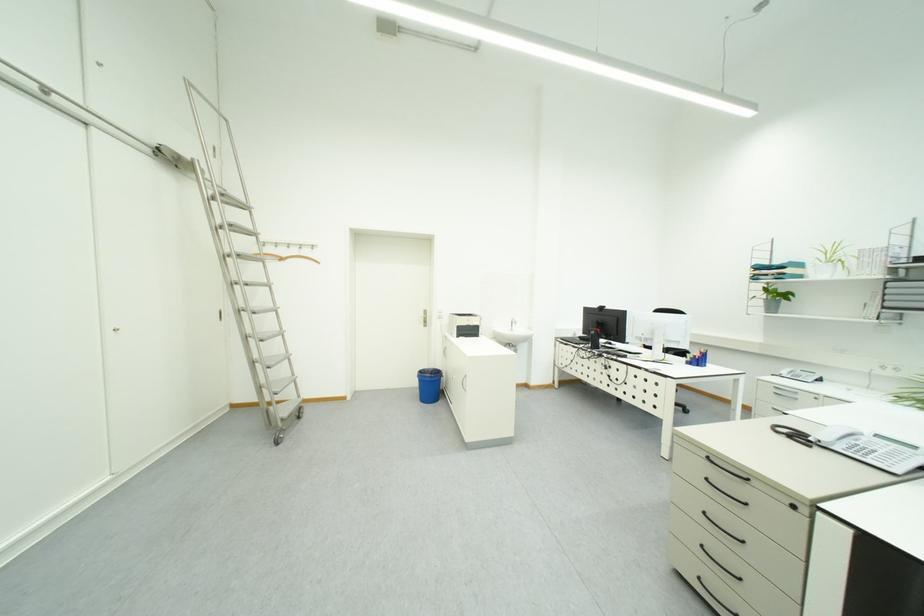
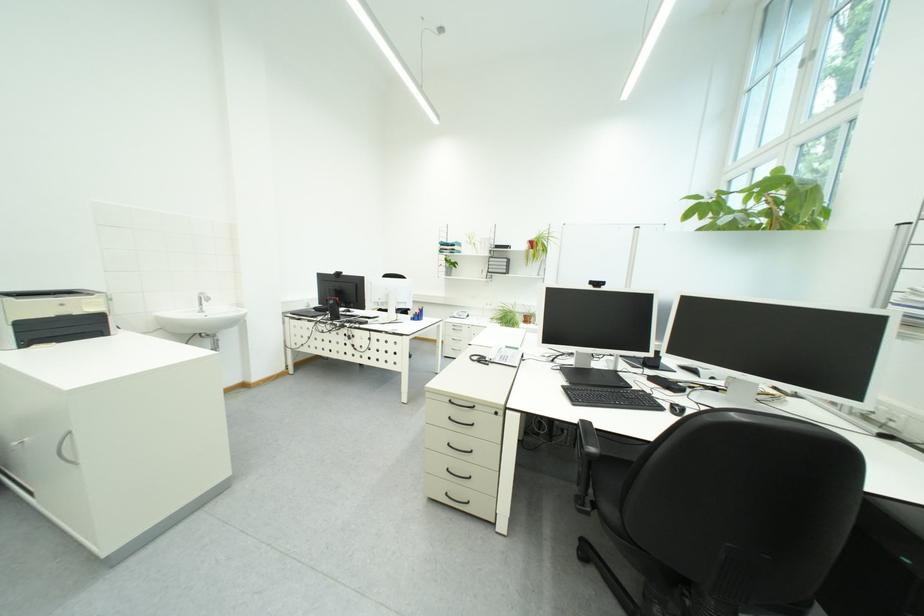
Find the pixel in the second image that matches (476,323) in the first image.

(55, 310)